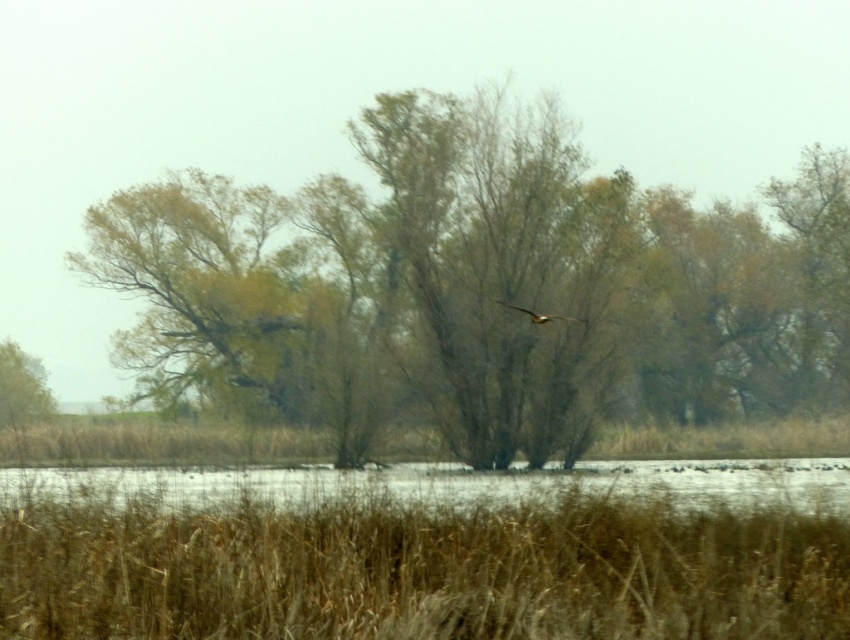
Is clear water at lower center bigger than brown feathered bird at center?

Correct, clear water at lower center is larger in size than brown feathered bird at center.

Is clear water at lower center shorter than brown feathered bird at center?

Incorrect, clear water at lower center's height does not fall short of brown feathered bird at center's.

Between point (828, 461) and point (531, 312), which one is positioned behind?

The point (828, 461) is more distant.

This screenshot has width=850, height=640. Find the location of `clear water at lower center`. clear water at lower center is located at coordinates click(x=446, y=484).

Who is positioned more to the right, brown dry grass at lower center or clear water at lower center?

brown dry grass at lower center

Does point (337, 621) come behind point (214, 468)?

No.

Where is `brown dry grass at lower center`? brown dry grass at lower center is located at coordinates (428, 552).

Between point (323, 413) and point (584, 321), which one is positioned in front?

Positioned in front is point (584, 321).

Find the location of `brown leafy tree at center`. brown leafy tree at center is located at coordinates (479, 289).

You are a GUI agent. You are given a task and a screenshot of the screen. Output one action in this format:
    pyautogui.click(x=<x>, y=<y>)
    Task: Click on the brown leafy tree at center
    Image resolution: width=850 pixels, height=640 pixels.
    Given the screenshot: What is the action you would take?
    pyautogui.click(x=479, y=289)